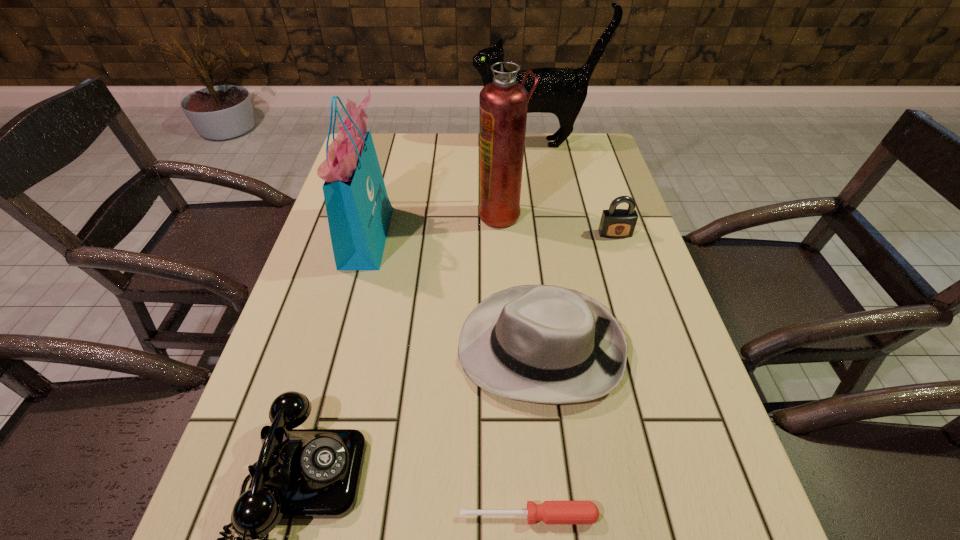
Locate an element on the screen. The image size is (960, 540). unoccupied position between the shortest object and the fedora is located at coordinates (535, 431).

The height and width of the screenshot is (540, 960). In order to click on free space that is in between the shopping bag and the cat in this screenshot , I will do `click(451, 189)`.

Where is `free space between the cat and the shopping bag`? This screenshot has height=540, width=960. free space between the cat and the shopping bag is located at coordinates click(451, 189).

At what (x,y) coordinates should I click in order to perform the action: click on empty space between the padlock and the cat. Please return your answer as a coordinate pair (x, y). This screenshot has height=540, width=960. Looking at the image, I should click on (575, 188).

Locate an element on the screen. This screenshot has width=960, height=540. free point between the padlock and the fire extinguisher is located at coordinates (559, 224).

Where is `blank region between the fedora and the shortest object`? This screenshot has width=960, height=540. blank region between the fedora and the shortest object is located at coordinates (535, 431).

Select which object is the second closest to the fire extinguisher. Please provide its 2D coordinates. Your answer should be formatted as a tuple, i.e. [(x, y)], where the tuple contains the x and y coordinates of a point satisfying the conditions above.

[(544, 344)]

Locate which object is the fourth closest to the telephone. Please provide its 2D coordinates. Your answer should be formatted as a tuple, i.e. [(x, y)], where the tuple contains the x and y coordinates of a point satisfying the conditions above.

[(503, 103)]

You are a GUI agent. You are given a task and a screenshot of the screen. Output one action in this format:
    pyautogui.click(x=<x>, y=<y>)
    Task: Click on the free space that satisfies the following two spatial constraints: 1. on the back side of the screwdriver; 2. on the side of the fire extinguisher with the label
    The image size is (960, 540).
    Given the screenshot: What is the action you would take?
    pyautogui.click(x=508, y=214)

Locate an element on the screen. The width and height of the screenshot is (960, 540). free region that satisfies the following two spatial constraints: 1. on the face of the farthest object; 2. on the front side of the shortest object is located at coordinates (598, 516).